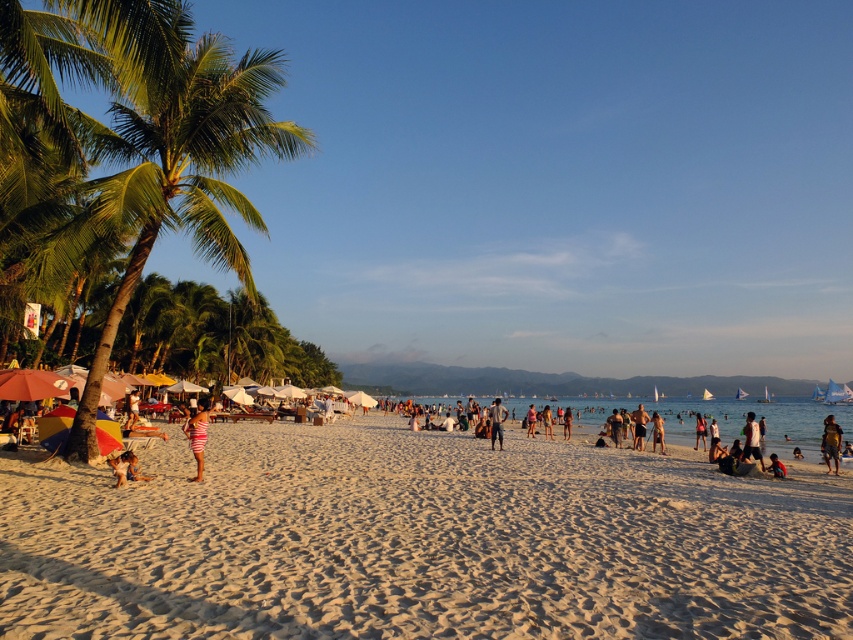
Question: Estimate the real-world distances between objects in this image. Which object is closer to the tan skin person at center?

Choices:
 (A) light brown sand at center
 (B) green leafy palm tree at left

Answer: (A)

Question: Is green leafy palm tree at left bigger than pink striped shirt at center?

Choices:
 (A) no
 (B) yes

Answer: (B)

Question: Estimate the real-world distances between objects in this image. Which object is farther from the green leafy palm tree at left?

Choices:
 (A) striped fabric swimsuit at center
 (B) dark brown wooden surfboard at lower right
 (C) light brown sand at center
 (D) white cotton shirt at center

Answer: (B)

Question: Which object appears closest to the camera in this image?

Choices:
 (A) pink striped shirt at center
 (B) striped fabric swimsuit at center
 (C) sandy beach at lower center

Answer: (C)

Question: Is striped fabric swimsuit at center thinner than tan skin person at center?

Choices:
 (A) no
 (B) yes

Answer: (A)

Question: Is striped fabric swimsuit at center to the left of pink striped shirt at center from the viewer's perspective?

Choices:
 (A) no
 (B) yes

Answer: (B)